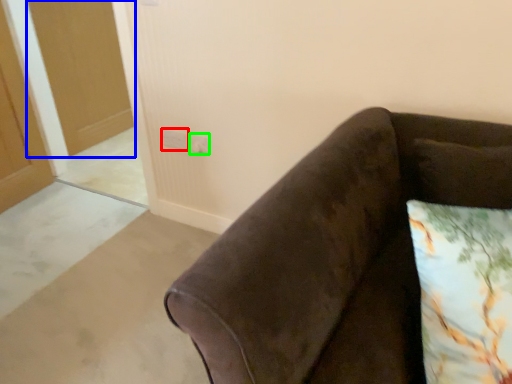
Question: Which object is the farthest from electric outlet (highlighted by a red box)? Choose among these: glass door (highlighted by a blue box) or electric outlet (highlighted by a green box).

Choices:
 (A) glass door
 (B) electric outlet

Answer: (A)